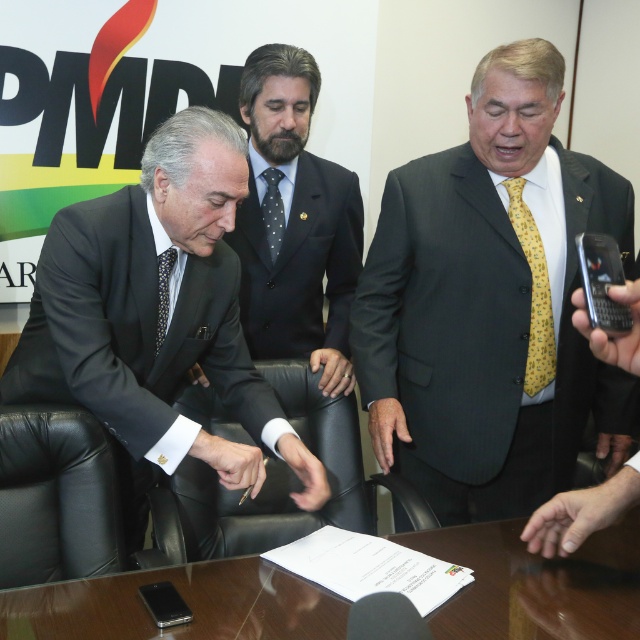
You are a photographer in the room and want to capture a closeup of the yellow textured tie at center and the glossy wooden table at center. Which object is closer to the camera based on their positions?

The yellow textured tie at center is taller than the glossy wooden table at center, so the yellow textured tie at center is closer to the camera.

In the scene where three men are in a formal meeting, there is a point marked at coordinates (490,305). Which object from the list corresponds to this point? The objects are the yellow textured tie at center and the document on the table before him.

A: The point at coordinates (490,305) corresponds to the yellow textured tie at center as indicated in the objects description.

From the picture: You are a photographer standing in the scene and want to take a closeup photo of the yellow textured tie at center. What is the minimum distance you need to move closer to the tie to ensure the photo is in focus? Assume your camera requires a minimum focus distance of 1.5 meters.

The yellow textured tie at center and viewer are 1.51 meters apart. Since the camera requires a minimum focus distance of 1.5 meters, you need to move 0.01 meters closer to the tie to ensure it is in focus.